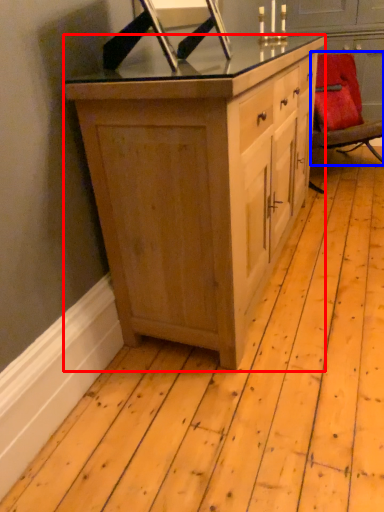
Question: Among these objects, which one is nearest to the camera, cabinetry (highlighted by a red box) or chair (highlighted by a blue box)?

Choices:
 (A) cabinetry
 (B) chair

Answer: (A)